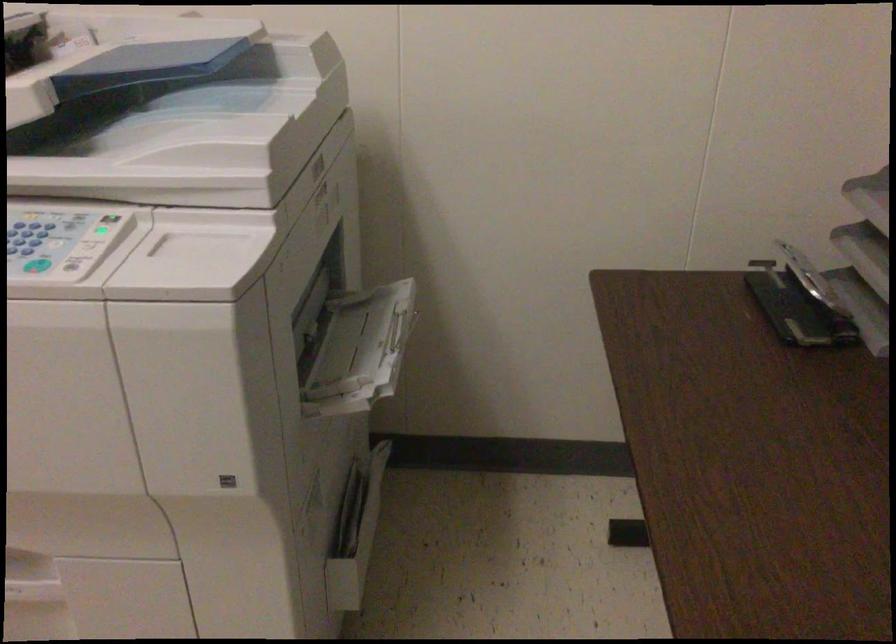
Where would you push the open paper tray? Please return your answer as a coordinate pair (x, y).

(345, 342)